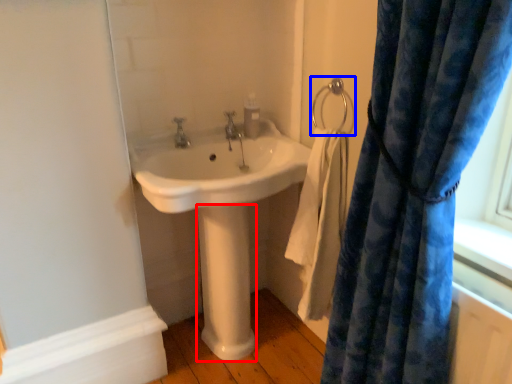
Question: Which object is closer to the camera taking this photo, pillar (highlighted by a red box) or shower (highlighted by a blue box)?

Choices:
 (A) pillar
 (B) shower

Answer: (B)